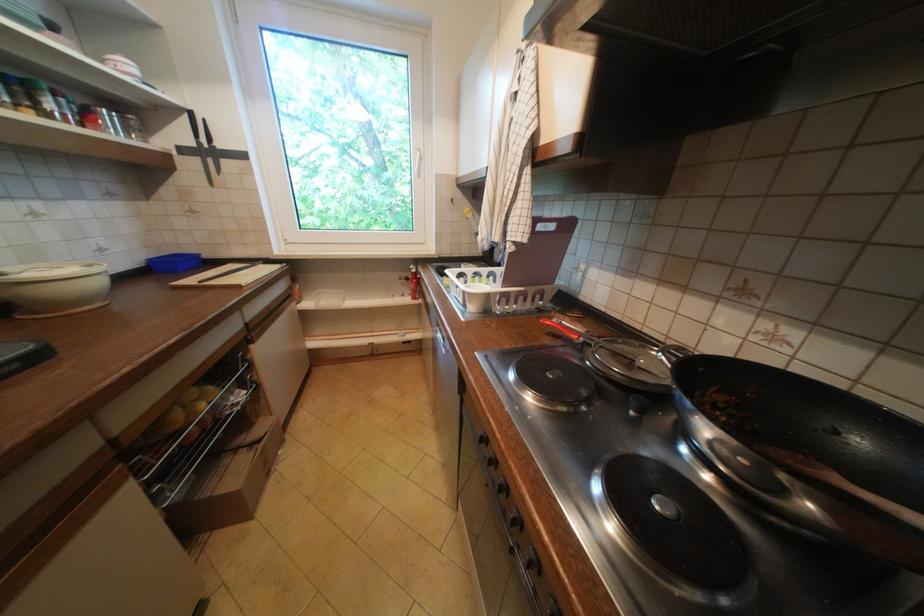
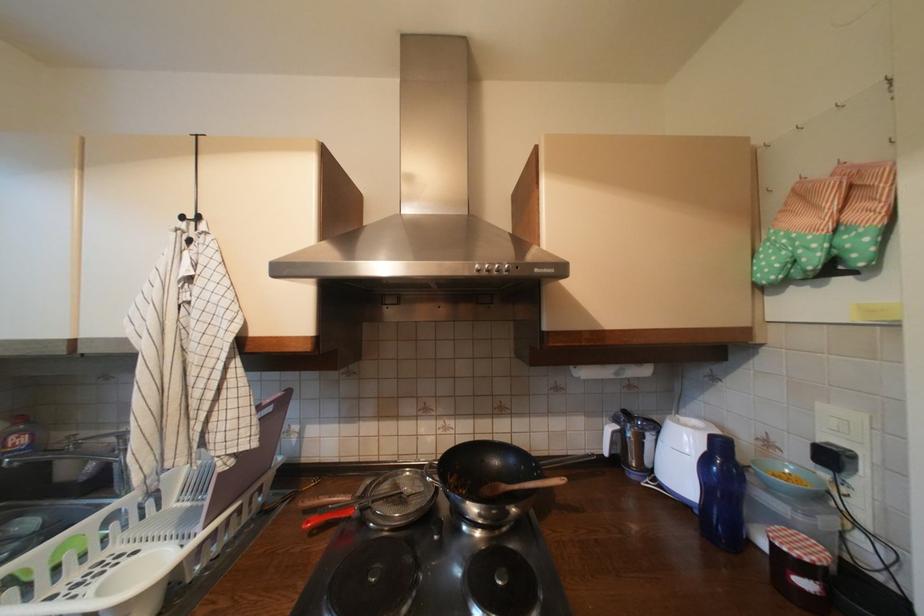
The point at (642, 362) is marked in the first image. Where is the corresponding point in the second image?

(410, 495)